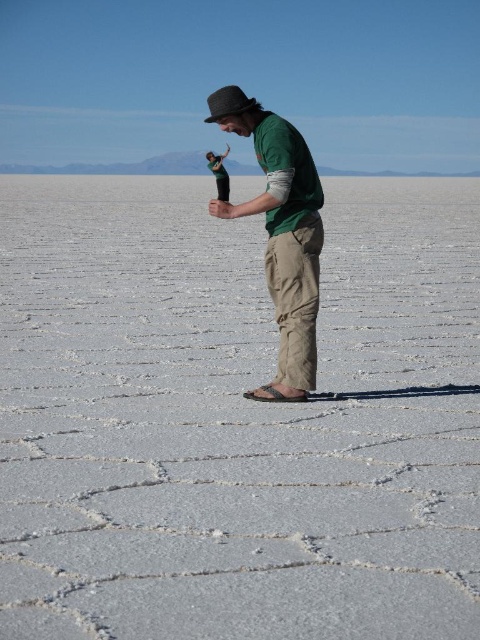
You are standing at the point marked by the coordinates point (236, 419) on the salt flat. Looking around, you notice a matte black bottle at center. Which direction should you face to see the matte black bottle at center?

You are already facing the matte black bottle at center because you are standing at the point marked by the coordinates point (236, 419), which is where the matte black bottle at center is located.

You are a photographer planning to take a picture of the matte black bottle at center and the green cotton shirt at center. Which object should you focus on first if you want to capture both in sharp detail?

The matte black bottle at center has a larger size compared to the green cotton shirt at center, so you should focus on the matte black bottle at center first to ensure both are in sharp detail.

You are a photographer positioned on the salt flat and want to capture both the matte black bottle at center and the green cotton shirt at center in a single frame. Which object should you focus on first to ensure both are in focus?

The matte black bottle at center is located above the green cotton shirt at center, so focusing on the green cotton shirt at center first will ensure both are in focus as the bottle is above it.